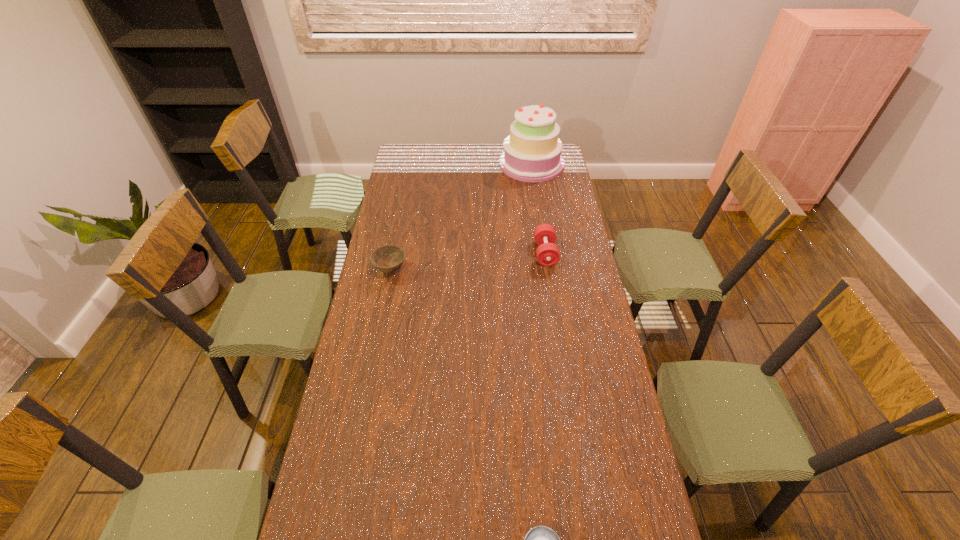
The width and height of the screenshot is (960, 540). In order to click on dumbbell present at the right edge in this screenshot , I will do `click(547, 253)`.

This screenshot has width=960, height=540. In order to click on object that is at the far right corner in this screenshot , I will do `click(532, 152)`.

At what (x,y) coordinates should I click in order to perform the action: click on vacant space at the left edge of the desktop. Please return your answer as a coordinate pair (x, y). The width and height of the screenshot is (960, 540). Looking at the image, I should click on (319, 477).

I want to click on vacant area at the right edge, so click(x=564, y=212).

Where is `vacant area at the far left corner of the desktop`? Image resolution: width=960 pixels, height=540 pixels. vacant area at the far left corner of the desktop is located at coordinates (426, 144).

You are a GUI agent. You are given a task and a screenshot of the screen. Output one action in this format:
    pyautogui.click(x=<x>, y=<y>)
    Task: Click on the free space that is in between the dumbbell and the leftmost object
    The height and width of the screenshot is (540, 960).
    Given the screenshot: What is the action you would take?
    pyautogui.click(x=468, y=261)

Find the location of `object that ranks as the closest to the nearest object`. object that ranks as the closest to the nearest object is located at coordinates (547, 253).

Identify the location of object that ranks as the third closest to the farthest object. The image size is (960, 540). (541, 539).

Where is `vacant region that satisfies the following two spatial constraints: 1. on the front side of the cake; 2. on the left side of the dumbbell`? This screenshot has width=960, height=540. vacant region that satisfies the following two spatial constraints: 1. on the front side of the cake; 2. on the left side of the dumbbell is located at coordinates (544, 253).